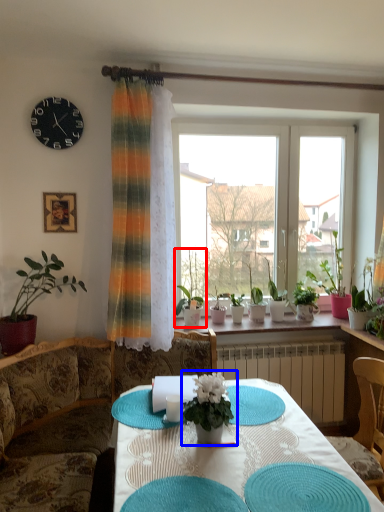
Question: Which object appears farthest to the camera in this image, houseplant (highlighted by a red box) or houseplant (highlighted by a blue box)?

Choices:
 (A) houseplant
 (B) houseplant

Answer: (A)